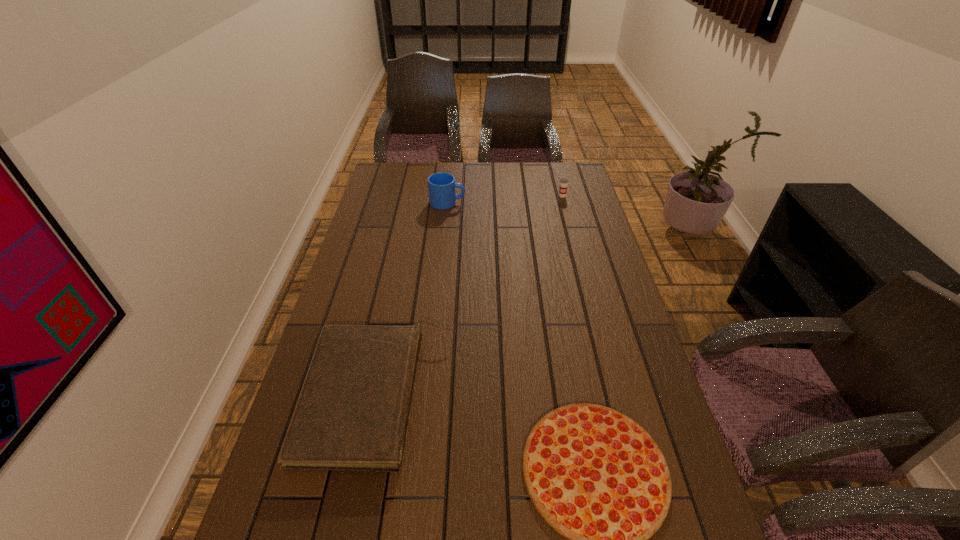
You are a GUI agent. You are given a task and a screenshot of the screen. Output one action in this format:
    pyautogui.click(x=<x>, y=<y>)
    Task: Click on the free space at the right edge
    The width and height of the screenshot is (960, 540).
    Given the screenshot: What is the action you would take?
    pyautogui.click(x=577, y=297)

In the image, there is a desktop. Where is `vacant space at the far left corner`? vacant space at the far left corner is located at coordinates (413, 184).

At what (x,y) coordinates should I click in order to perform the action: click on vacant space that is in between the third tallest object and the mug. Please return your answer as a coordinate pair (x, y). Looking at the image, I should click on (413, 299).

You are a GUI agent. You are given a task and a screenshot of the screen. Output one action in this format:
    pyautogui.click(x=<x>, y=<y>)
    Task: Click on the empty location between the paperback book and the mug
    The image size is (960, 540).
    Given the screenshot: What is the action you would take?
    pyautogui.click(x=413, y=299)

In order to click on unoccupied position between the mug and the cup in this screenshot , I will do `click(505, 199)`.

Locate an element on the screen. vacant area that lies between the cup and the mug is located at coordinates (505, 199).

You are a GUI agent. You are given a task and a screenshot of the screen. Output one action in this format:
    pyautogui.click(x=<x>, y=<y>)
    Task: Click on the free space between the cup and the third tallest object
    The image size is (960, 540).
    Given the screenshot: What is the action you would take?
    pyautogui.click(x=470, y=296)

In order to click on vacant space that's between the cup and the mug in this screenshot , I will do `click(505, 199)`.

What are the coordinates of `vacant area that lies between the third tallest object and the cup` in the screenshot? It's located at (470, 296).

Locate an element on the screen. free point between the third tallest object and the cup is located at coordinates (470, 296).